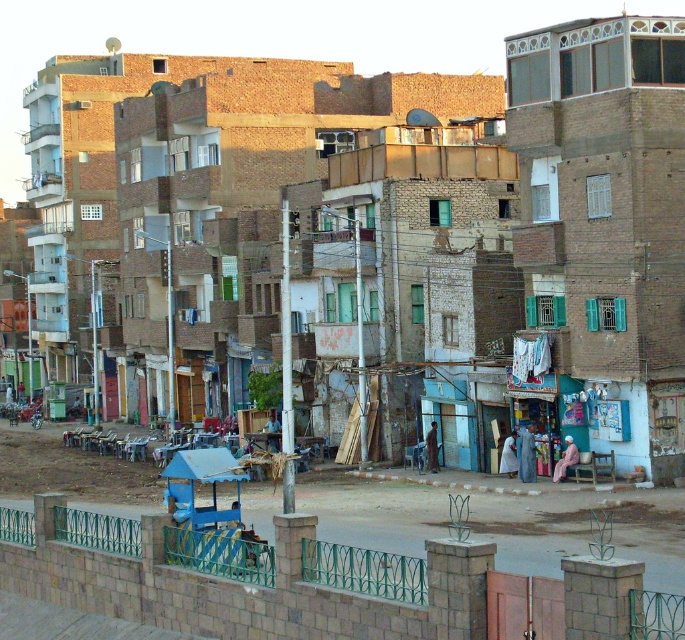
Question: Which point is farther to the camera?

Choices:
 (A) pyautogui.click(x=566, y=464)
 (B) pyautogui.click(x=525, y=456)
 (C) pyautogui.click(x=436, y=426)

Answer: (C)

Question: Which object is closer to the camera taking this photo?

Choices:
 (A) dark blue fabric at center
 (B) light blue fabric at center
 (C) light brown wooden bench at center

Answer: (B)

Question: Does blue fabric dress at lower center come in front of light brown wooden bench at center?

Choices:
 (A) yes
 (B) no

Answer: (A)

Question: Which point is farther to the camera?

Choices:
 (A) (274, 444)
 (B) (427, 461)

Answer: (A)

Question: Is light blue fabric at center positioned at the back of dark blue fabric at center?

Choices:
 (A) no
 (B) yes

Answer: (A)

Question: Can you confirm if pink fabric at lower center is smaller than light brown wooden bench at center?

Choices:
 (A) yes
 (B) no

Answer: (A)